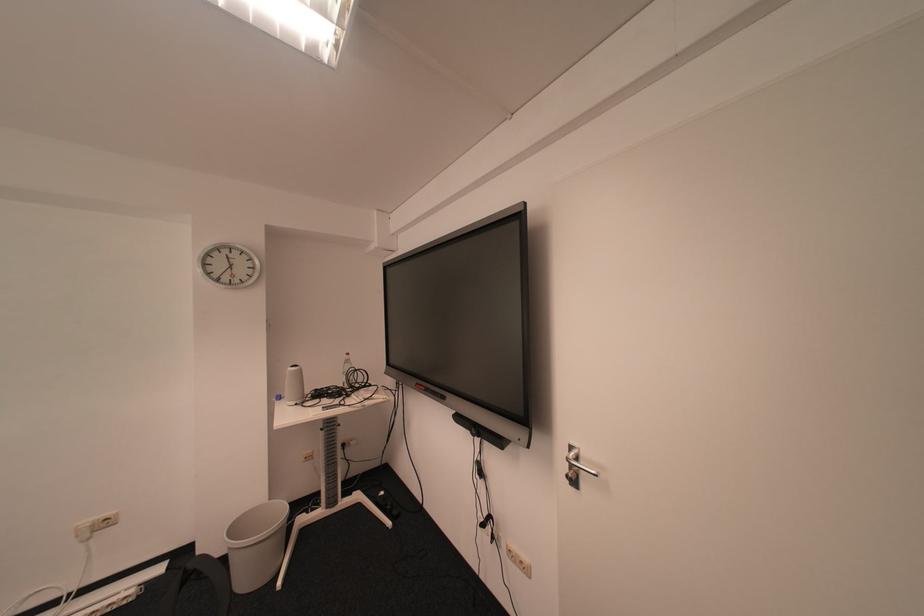
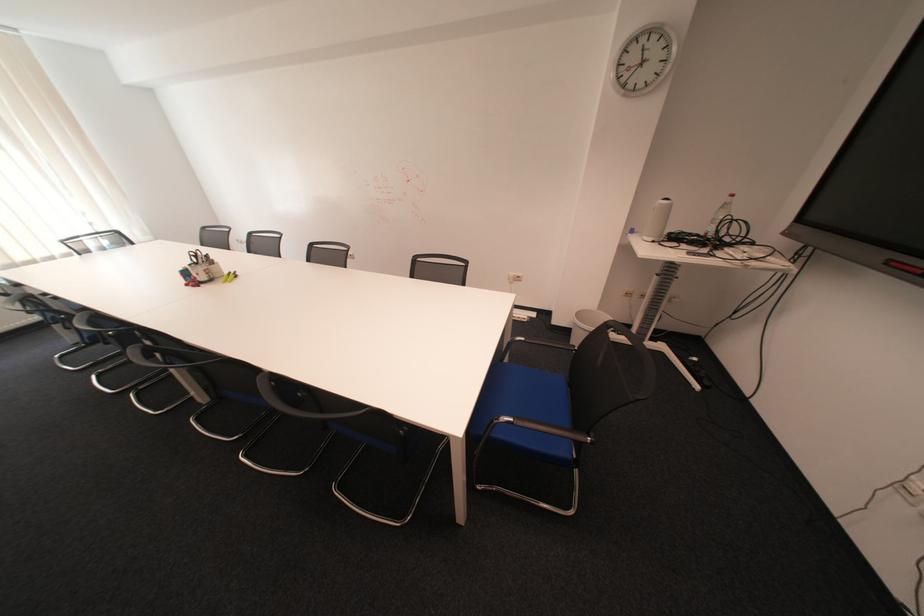
Where in the second image is the point corresponding to [350,381] from the first image?

(714, 229)